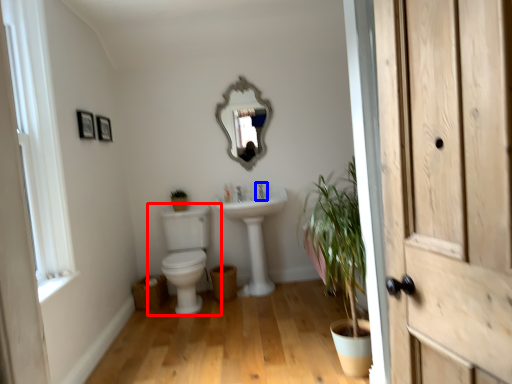
Question: Which object is further to the camera taking this photo, toilet (highlighted by a red box) or tap (highlighted by a blue box)?

Choices:
 (A) toilet
 (B) tap

Answer: (B)